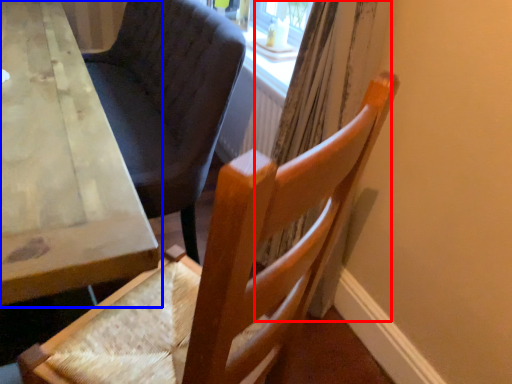
Question: Which object appears closest to the camera in this image, curtain (highlighted by a red box) or table (highlighted by a blue box)?

Choices:
 (A) curtain
 (B) table

Answer: (B)